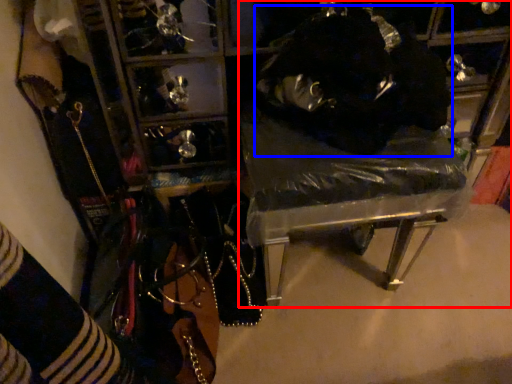
Question: Among these objects, which one is farthest to the camera, furniture (highlighted by a red box) or person (highlighted by a blue box)?

Choices:
 (A) furniture
 (B) person

Answer: (A)